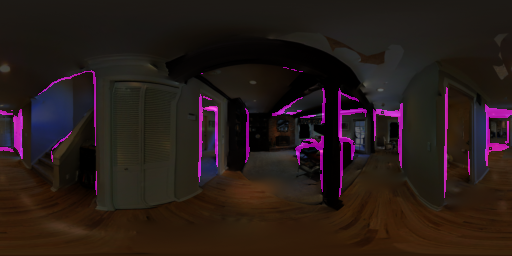
This screenshot has height=256, width=512. What are the coordinates of `stairs` in the screenshot? It's located at (44, 158).